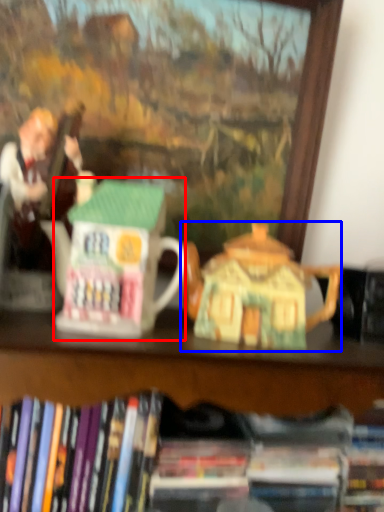
Question: Which object appears closest to the camera in this image, toy (highlighted by a red box) or teapot (highlighted by a blue box)?

Choices:
 (A) toy
 (B) teapot

Answer: (A)